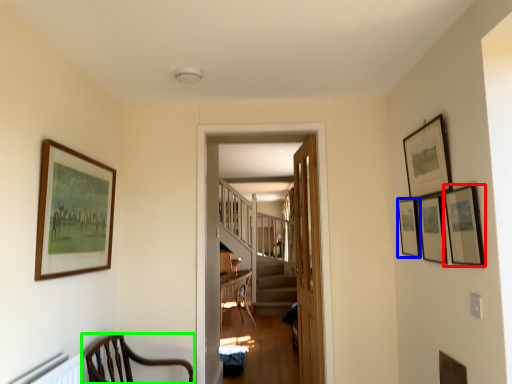
Question: Estimate the real-world distances between objects in this image. Which object is farther from picture frame (highlighted by a red box), picture frame (highlighted by a blue box) or chair (highlighted by a green box)?

Choices:
 (A) picture frame
 (B) chair

Answer: (B)